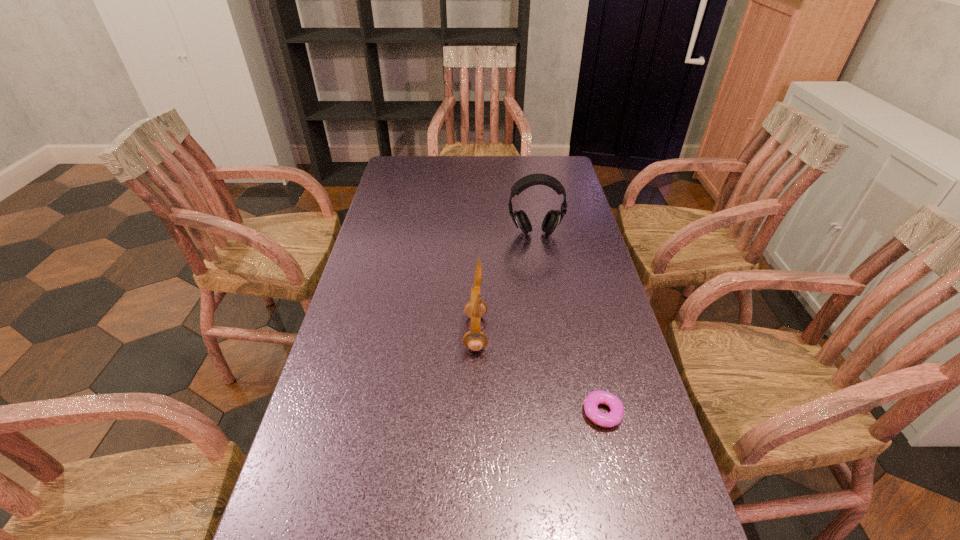
This screenshot has width=960, height=540. Find the location of `doughnut that is at the right edge`. doughnut that is at the right edge is located at coordinates (593, 399).

In the image, there is a desktop. At what (x,y) coordinates should I click in order to perform the action: click on vacant space at the far edge. Please return your answer as a coordinate pair (x, y). The width and height of the screenshot is (960, 540). Looking at the image, I should click on (522, 163).

Image resolution: width=960 pixels, height=540 pixels. What are the coordinates of `vacant region at the left edge of the desktop` in the screenshot? It's located at (344, 375).

In the image, there is a desktop. Where is `vacant space at the right edge`? vacant space at the right edge is located at coordinates pos(579,245).

I want to click on vacant area at the far left corner, so click(x=400, y=165).

The height and width of the screenshot is (540, 960). What are the coordinates of `free location at the far right corner` in the screenshot? It's located at (550, 168).

Where is `free space between the left earphone and the shortest object`? This screenshot has height=540, width=960. free space between the left earphone and the shortest object is located at coordinates (539, 373).

Locate an element on the screen. The image size is (960, 540). empty space between the left earphone and the shortest object is located at coordinates (539, 373).

This screenshot has height=540, width=960. Identify the location of vacant region between the leftmost object and the nearest object. (539, 373).

Where is `empty space that is in between the doughnut and the leftmost object`? empty space that is in between the doughnut and the leftmost object is located at coordinates (539, 373).